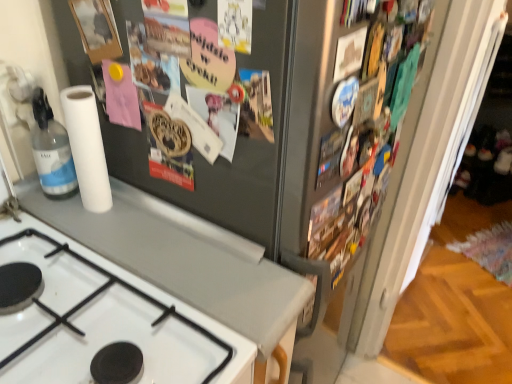
This screenshot has height=384, width=512. I want to click on free spot to the right of white matte paper towel at left, so click(x=151, y=233).